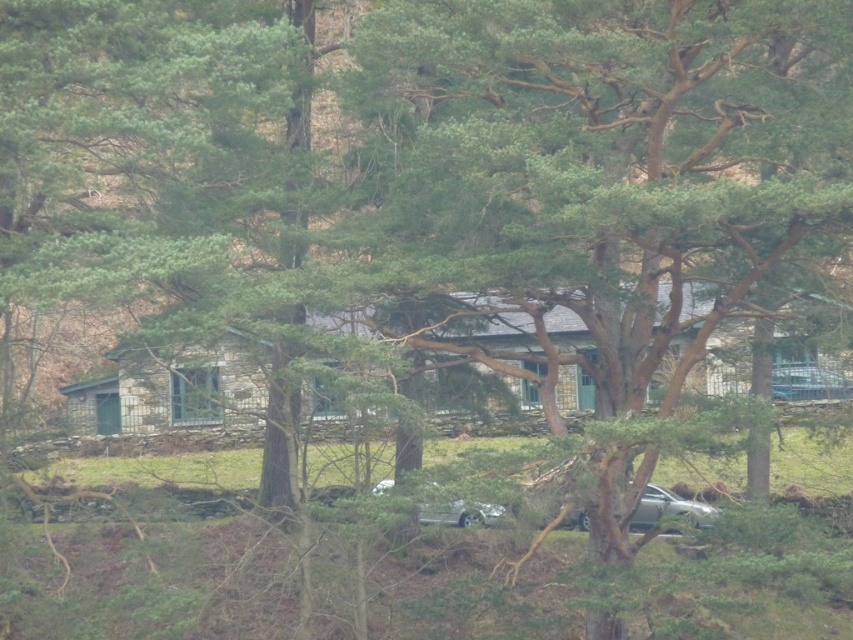
Question: Which point is farther to the camera?

Choices:
 (A) (418, 518)
 (B) (691, 518)

Answer: (A)

Question: Can you confirm if silver metallic car at lower center is thinner than metallic silver car at center?

Choices:
 (A) yes
 (B) no

Answer: (B)

Question: Which object appears closest to the camera in this image?

Choices:
 (A) silver metallic car at lower center
 (B) metallic silver car at center

Answer: (B)

Question: Can you confirm if silver metallic car at lower center is smaller than metallic silver car at center?

Choices:
 (A) no
 (B) yes

Answer: (B)

Question: Does silver metallic car at lower center appear on the right side of metallic silver car at center?

Choices:
 (A) no
 (B) yes

Answer: (B)